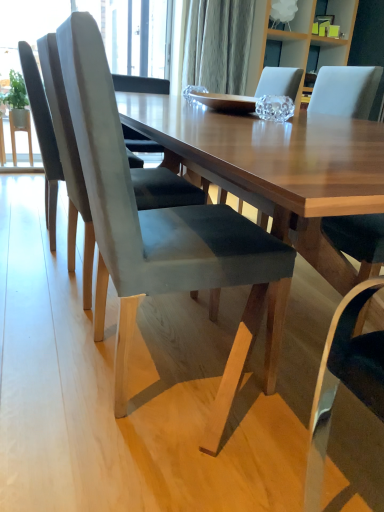
Question: Considering the relative sizes of suede gray chair at left, which is the second chair in back-to-front order, and suede gray chair at center, which is the 1th chair in front-to-back order, in the image provided, is suede gray chair at left, which is the second chair in back-to-front order, smaller than suede gray chair at center, which is the 1th chair in front-to-back order,?

Choices:
 (A) yes
 (B) no

Answer: (A)

Question: Considering the relative sizes of suede gray chair at left, which is the second chair in back-to-front order, and suede gray chair at center, which is the 1th chair in front-to-back order, in the image provided, is suede gray chair at left, which is the second chair in back-to-front order, bigger than suede gray chair at center, which is the 1th chair in front-to-back order,?

Choices:
 (A) yes
 (B) no

Answer: (B)

Question: Can you confirm if suede gray chair at left, arranged as the 2th chair when viewed from the front, is wider than suede gray chair at center, which is the 1th chair in front-to-back order?

Choices:
 (A) yes
 (B) no

Answer: (A)

Question: From a real-world perspective, is suede gray chair at left, arranged as the 2th chair when viewed from the front, positioned over suede gray chair at center, acting as the third chair starting from the back, based on gravity?

Choices:
 (A) no
 (B) yes

Answer: (B)

Question: From a real-world perspective, is suede gray chair at left, which is the second chair in back-to-front order, positioned under suede gray chair at center, which is the 1th chair in front-to-back order, based on gravity?

Choices:
 (A) yes
 (B) no

Answer: (B)

Question: Is suede gray chair at left, which is the second chair in back-to-front order, thinner than suede gray chair at center, which is the 1th chair in front-to-back order?

Choices:
 (A) no
 (B) yes

Answer: (A)

Question: Would you consider suede gray chair at left, acting as the 1th chair starting from the back, to be distant from suede gray chair at center, acting as the third chair starting from the back?

Choices:
 (A) yes
 (B) no

Answer: (B)

Question: Does suede gray chair at left, which is the 3th chair from front to back, have a smaller size compared to suede gray chair at center, acting as the third chair starting from the back?

Choices:
 (A) no
 (B) yes

Answer: (B)

Question: Is the position of suede gray chair at left, which is the 3th chair from front to back, less distant than that of suede gray chair at center, acting as the third chair starting from the back?

Choices:
 (A) no
 (B) yes

Answer: (A)

Question: Does suede gray chair at left, acting as the 1th chair starting from the back, touch suede gray chair at center, which is the 1th chair in front-to-back order?

Choices:
 (A) no
 (B) yes

Answer: (A)

Question: From a real-world perspective, does suede gray chair at left, acting as the 1th chair starting from the back, stand above suede gray chair at center, which is the 1th chair in front-to-back order?

Choices:
 (A) no
 (B) yes

Answer: (B)

Question: Considering the relative sizes of suede gray chair at left, acting as the 1th chair starting from the back, and suede gray chair at center, which is the 1th chair in front-to-back order, in the image provided, is suede gray chair at left, acting as the 1th chair starting from the back, thinner than suede gray chair at center, which is the 1th chair in front-to-back order,?

Choices:
 (A) yes
 (B) no

Answer: (A)

Question: From the image's perspective, does suede gray chair at left, which is the 3th chair from front to back, appear lower than wooden table at center?

Choices:
 (A) no
 (B) yes

Answer: (A)